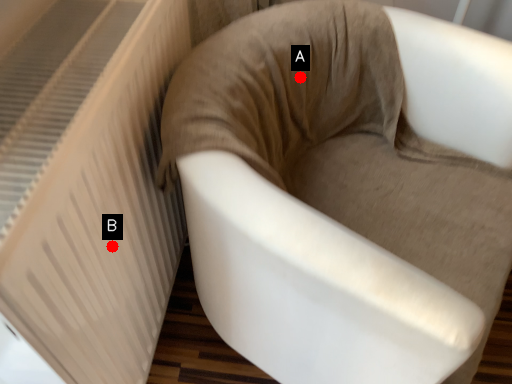
Question: Two points are circled on the image, labeled by A and B beside each circle. Which point is closer to the camera?

Choices:
 (A) A is closer
 (B) B is closer

Answer: (B)